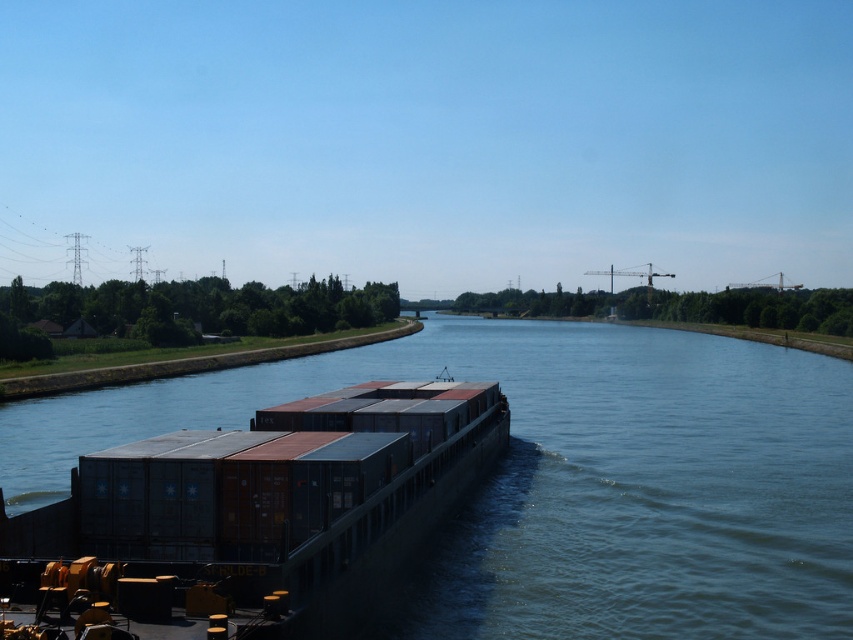
Who is more forward, (566, 570) or (177, 438)?

Point (177, 438)

Does blue water at center have a lesser height compared to metallic gray containers at center?

No.

Find the location of a particular element. The image size is (853, 640). blue water at center is located at coordinates (567, 476).